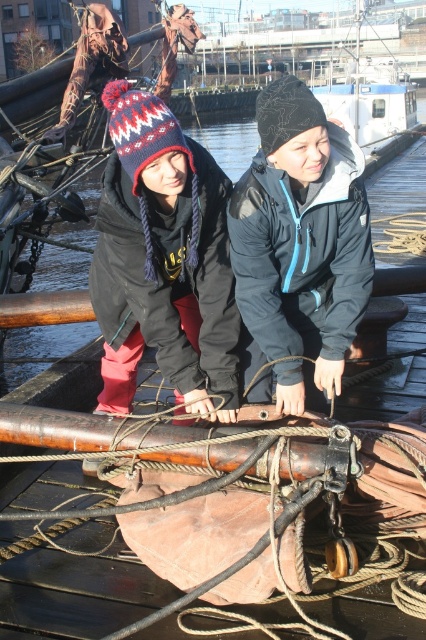
Question: Does knitted woolen hat at center appear under white plastic boat at upper center?

Choices:
 (A) yes
 (B) no

Answer: (A)

Question: Which object is closer to the camera taking this photo?

Choices:
 (A) white plastic boat at upper center
 (B) knitted woolen hat at center

Answer: (B)

Question: Does knitted woolen hat at center appear under white plastic boat at upper center?

Choices:
 (A) no
 (B) yes

Answer: (B)

Question: Which point is farther to the camera?

Choices:
 (A) (264, 170)
 (B) (351, 83)

Answer: (B)

Question: Can you confirm if knitted woolen hat at center is positioned above white plastic boat at upper center?

Choices:
 (A) no
 (B) yes

Answer: (A)